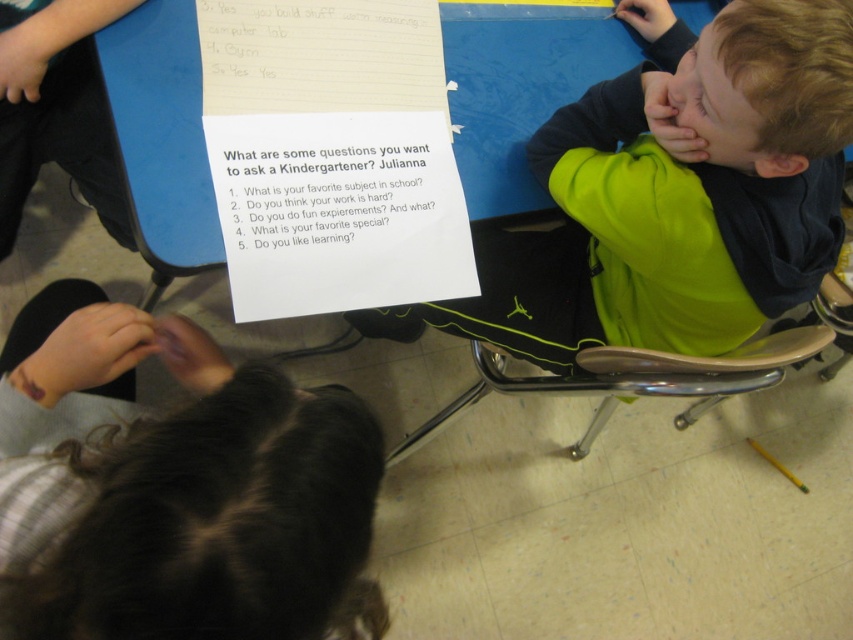
Question: Which of the following is the closest to the observer?

Choices:
 (A) neon green hoodie at right
 (B) dark brown hair at lower left
 (C) white paper at center

Answer: (B)

Question: Considering the relative positions of white paper at upper center and white paper at center in the image provided, where is white paper at upper center located with respect to white paper at center?

Choices:
 (A) right
 (B) left

Answer: (B)

Question: Estimate the real-world distances between objects in this image. Which object is closer to the white paper at upper center?

Choices:
 (A) white paper at center
 (B) dark brown hair at lower left
 (C) neon green hoodie at right

Answer: (A)

Question: Among these objects, which one is nearest to the camera?

Choices:
 (A) white paper at upper center
 (B) neon green hoodie at right
 (C) white paper at center
 (D) dark brown hair at lower left

Answer: (D)

Question: Can you confirm if white paper at upper center is positioned below white paper at center?

Choices:
 (A) no
 (B) yes

Answer: (A)

Question: Is dark brown hair at lower left bigger than white paper at upper center?

Choices:
 (A) yes
 (B) no

Answer: (A)